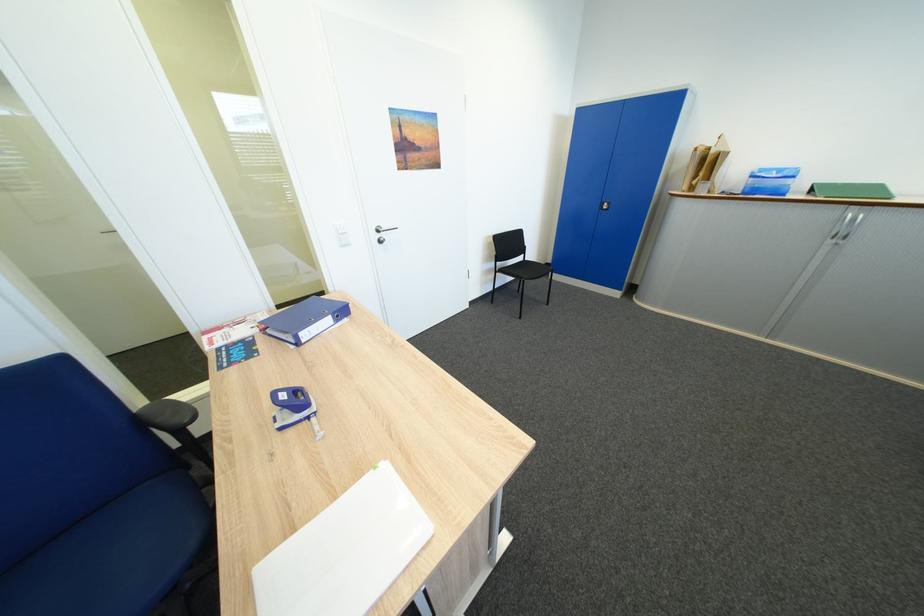
Locate an element on the screen. This screenshot has width=924, height=616. white door handle is located at coordinates (383, 233).